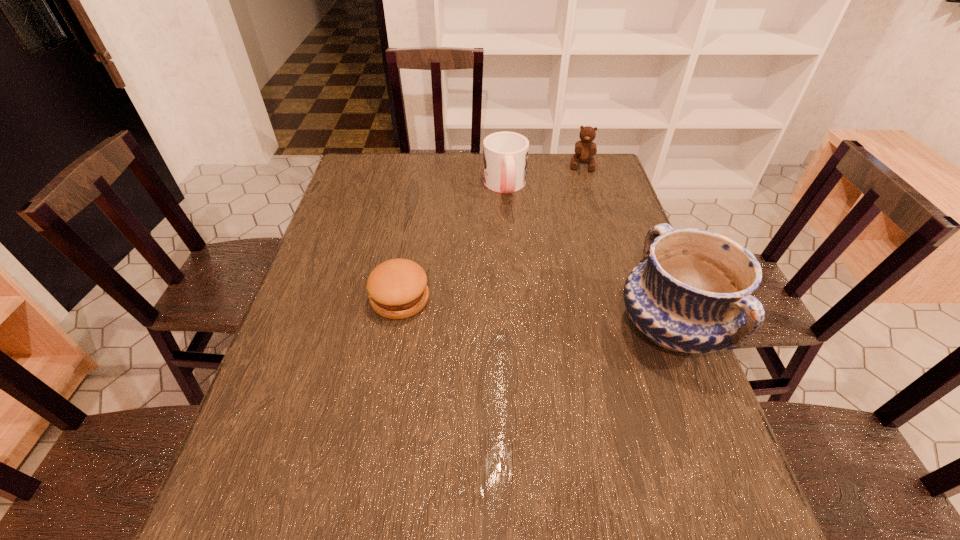
This screenshot has height=540, width=960. Find the location of `vacant space on the desktop that is between the leftmost object and the tallest object and is positioned on the side of the second object from left to right with the handle`. vacant space on the desktop that is between the leftmost object and the tallest object and is positioned on the side of the second object from left to right with the handle is located at coordinates (530, 312).

Locate an element on the screen. The width and height of the screenshot is (960, 540). free space on the desktop that is between the shortest object and the pottery and is positioned on the face of the teddy bear is located at coordinates (564, 316).